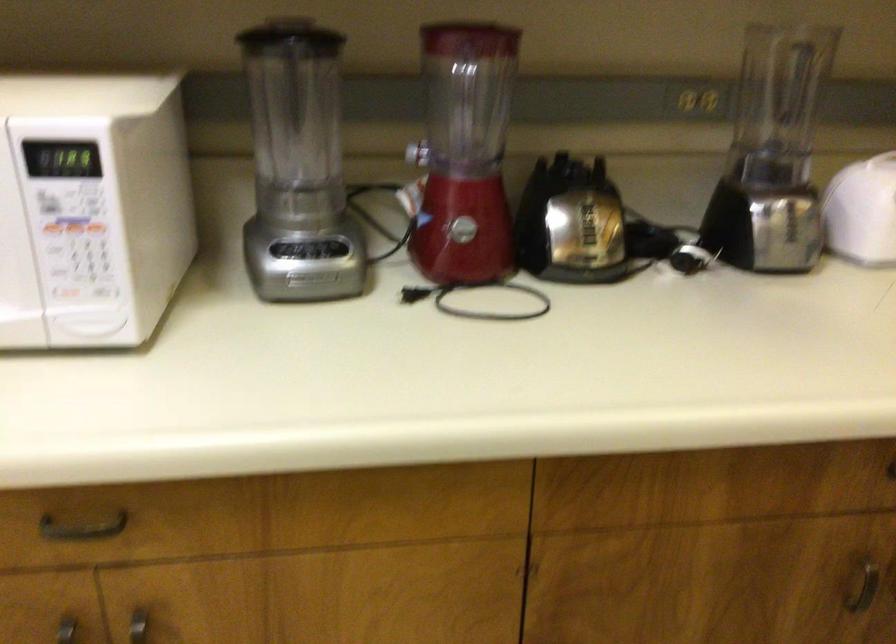
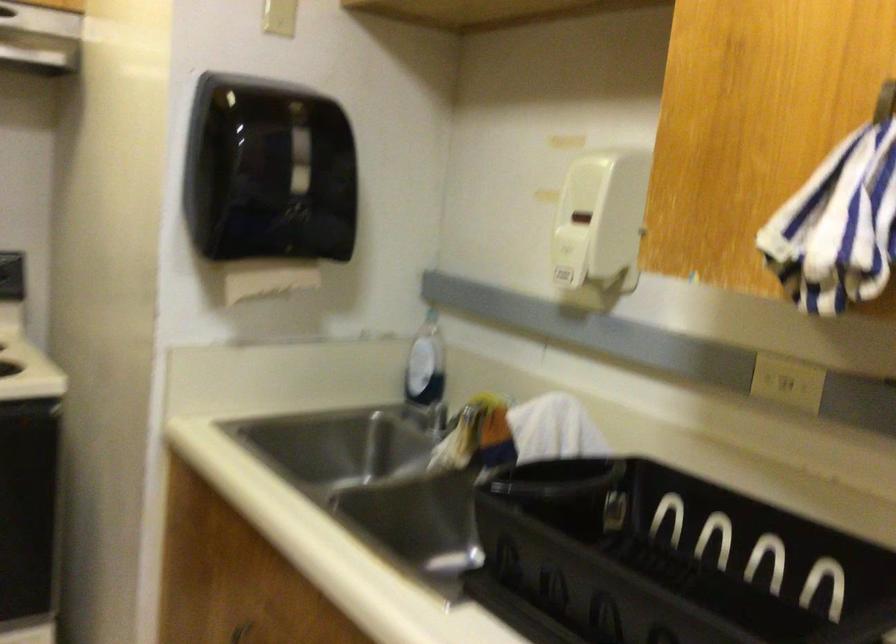
The first image is from the beginning of the video and the second image is from the end. How did the camera likely rotate when shooting the video?

The rotation direction of the camera is right-down.